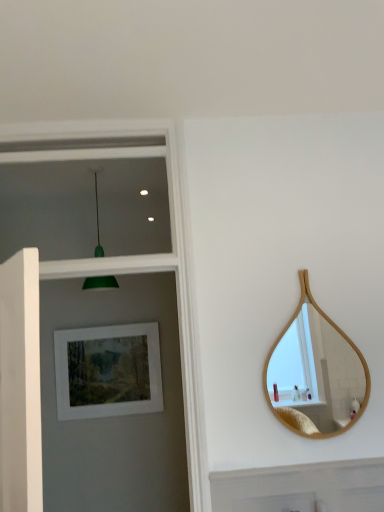
Question: Is the depth of green matte pendant light at upper left less than that of bamboo mirror at right?

Choices:
 (A) no
 (B) yes

Answer: (A)

Question: Could bamboo mirror at right be considered to be inside green matte pendant light at upper left?

Choices:
 (A) no
 (B) yes

Answer: (A)

Question: From the image's perspective, is green matte pendant light at upper left over bamboo mirror at right?

Choices:
 (A) no
 (B) yes

Answer: (B)

Question: Does green matte pendant light at upper left have a smaller size compared to bamboo mirror at right?

Choices:
 (A) no
 (B) yes

Answer: (A)

Question: Is green matte pendant light at upper left at the right side of bamboo mirror at right?

Choices:
 (A) yes
 (B) no

Answer: (B)

Question: Does green matte pendant light at upper left have a greater height compared to bamboo mirror at right?

Choices:
 (A) yes
 (B) no

Answer: (B)

Question: Is bamboo mirror at right positioned with its back to green matte pendant light at upper left?

Choices:
 (A) yes
 (B) no

Answer: (B)

Question: Is bamboo mirror at right taller than green matte pendant light at upper left?

Choices:
 (A) no
 (B) yes

Answer: (B)

Question: Is bamboo mirror at right next to green matte pendant light at upper left?

Choices:
 (A) yes
 (B) no

Answer: (B)

Question: Can you confirm if bamboo mirror at right is smaller than green matte pendant light at upper left?

Choices:
 (A) yes
 (B) no

Answer: (A)

Question: Is green matte pendant light at upper left a part of bamboo mirror at right?

Choices:
 (A) yes
 (B) no

Answer: (B)

Question: Would you say bamboo mirror at right is outside green matte pendant light at upper left?

Choices:
 (A) yes
 (B) no

Answer: (A)

Question: From the image's perspective, is bamboo mirror at right located above matte white picture frame at upper left?

Choices:
 (A) yes
 (B) no

Answer: (A)